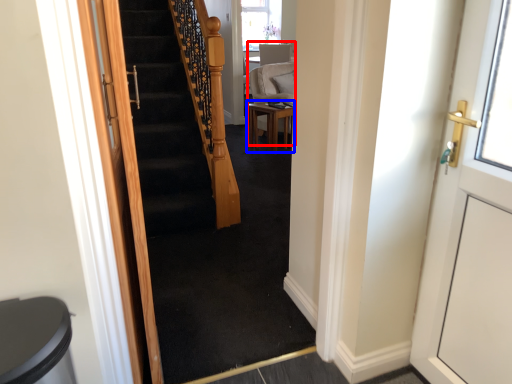
Question: Which of the following is the closest to the observer, armchair (highlighted by a red box) or table (highlighted by a blue box)?

Choices:
 (A) armchair
 (B) table

Answer: (B)